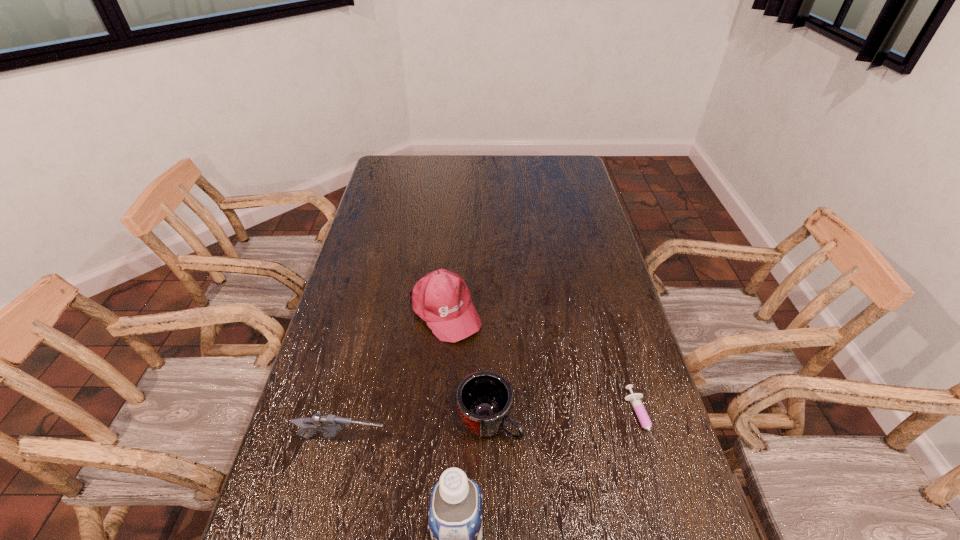
I want to click on free space on the desktop that is between the nearest object and the rightmost object and is positioned at the barrel of the gun, so click(566, 472).

You are a GUI agent. You are given a task and a screenshot of the screen. Output one action in this format:
    pyautogui.click(x=<x>, y=<y>)
    Task: Click on the free space on the desktop that is between the tallest object and the syringe and is positioned at the front of the baseball cap with the brim
    
    Given the screenshot: What is the action you would take?
    pyautogui.click(x=565, y=472)

Where is `vacant space on the desktop that is between the tallest object and the shortest object and is positioned on the side of the mug with the handle`? vacant space on the desktop that is between the tallest object and the shortest object and is positioned on the side of the mug with the handle is located at coordinates (561, 476).